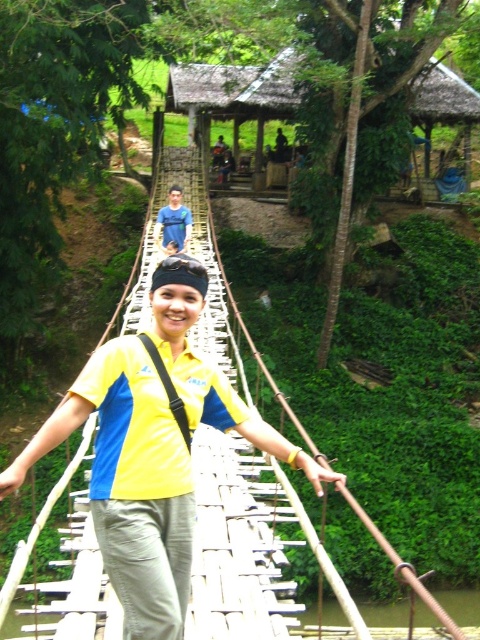
Does brown wooden bridge at center appear on the left side of blue denim jeans at center?

In fact, brown wooden bridge at center is to the right of blue denim jeans at center.

Looking at this image, does brown wooden bridge at center have a greater width compared to blue denim jeans at center?

Correct, the width of brown wooden bridge at center exceeds that of blue denim jeans at center.

At what (x,y) coordinates should I click in order to perform the action: click on brown wooden bridge at center. Please return your answer as a coordinate pair (x, y). Looking at the image, I should click on (462, 604).

Identify the location of brown wooden bridge at center. (462, 604).